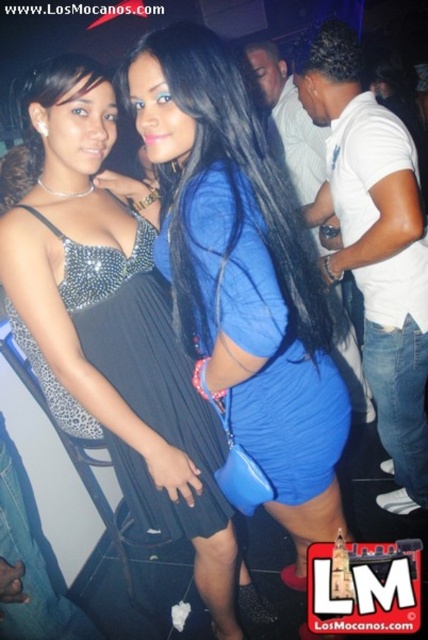
Does blue fabric dress at center have a greater width compared to black satin dress at left?

In fact, blue fabric dress at center might be narrower than black satin dress at left.

Which is behind, point (238, 273) or point (140, 314)?

The point (140, 314) is behind.

Which is behind, point (205, 168) or point (151, 298)?

The point (151, 298) is more distant.

Find the location of a particular element. The height and width of the screenshot is (640, 428). blue fabric dress at center is located at coordinates (261, 339).

Who is higher up, blue matte dress at center or blue fabric dress at center?

blue fabric dress at center is higher up.

Can you confirm if blue matte dress at center is taller than blue fabric dress at center?

Correct, blue matte dress at center is much taller as blue fabric dress at center.

The height and width of the screenshot is (640, 428). What are the coordinates of `blue matte dress at center` in the screenshot? It's located at (243, 275).

The image size is (428, 640). Find the location of `blue matte dress at center`. blue matte dress at center is located at coordinates (243, 275).

Is blue matte dress at center smaller than black satin dress at left?

Incorrect, blue matte dress at center is not smaller in size than black satin dress at left.

Can you confirm if blue matte dress at center is shorter than black satin dress at left?

In fact, blue matte dress at center may be taller than black satin dress at left.

Does point (296, 531) come farther from viewer compared to point (127, 449)?

That is True.

Find the location of `blue matte dress at center`. blue matte dress at center is located at coordinates (243, 275).